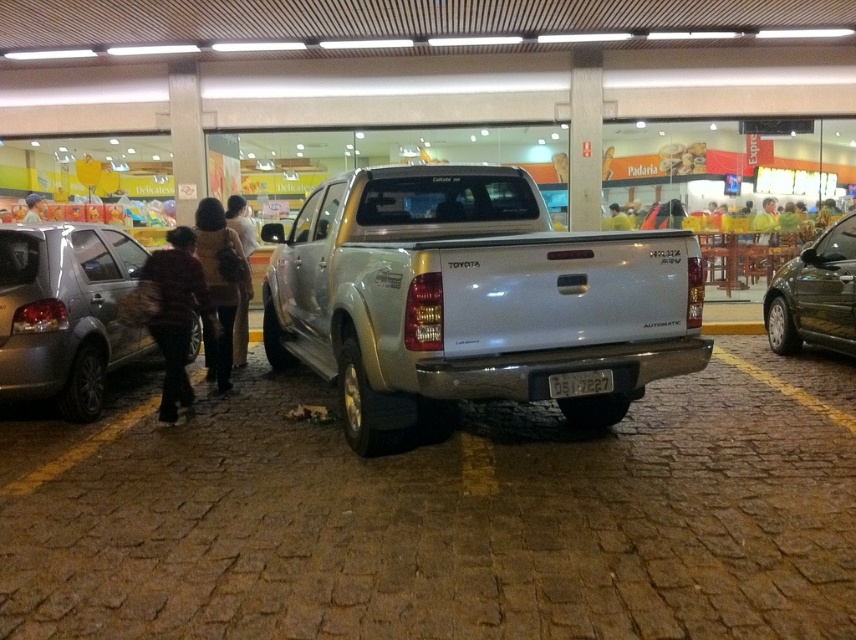
You are a delivery person who needs to load a large package into the silver metallic truck at center. The light brown leather jacket at left is blocking the truck bed. Can you lift the jacket to the side without moving the truck?

The silver metallic truck at center is below the light brown leather jacket at left, so you can easily lift the jacket to the side without moving the truck.

In the scene shown: You are a delivery person who needs to place a package between the brown fuzzy coat at center and the brown fuzzy coat at left. The package is 13 inches long. Will it fit between them?

The brown fuzzy coat at center and the brown fuzzy coat at left are 12.97 inches apart from each other. Since the package is 13 inches long, it will not fit between them as the distance is slightly less than the package length.

You are a delivery person standing next to your delivery van. You need to move your shiny dark green car at right into the parking spot in front of the silver Toyota pickup truck. The parking spot is 5 meters long. Can your car fit into the parking spot?

The shiny dark green car at right is 6.20 meters away from the viewer, but the parking spot is only 5 meters long. Therefore, the car cannot fit into the parking spot.